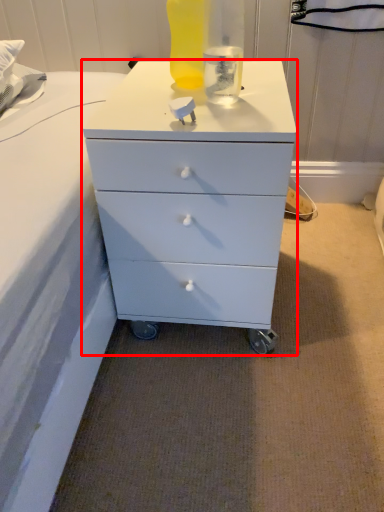
Question: From the image's perspective, where is chest of drawers (annotated by the red box) located relative to bottle?

Choices:
 (A) above
 (B) below

Answer: (B)